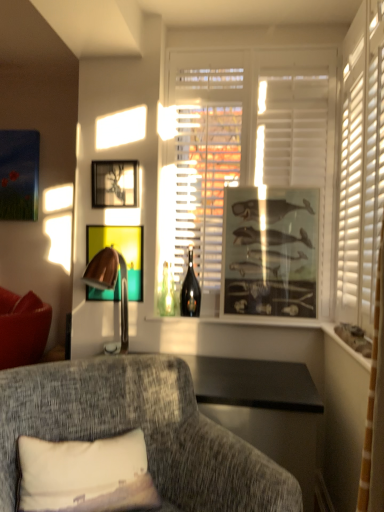
The width and height of the screenshot is (384, 512). Find the location of `empty space that is ontop of white matte window at center (from a real-world perspective)`. empty space that is ontop of white matte window at center (from a real-world perspective) is located at coordinates (253, 39).